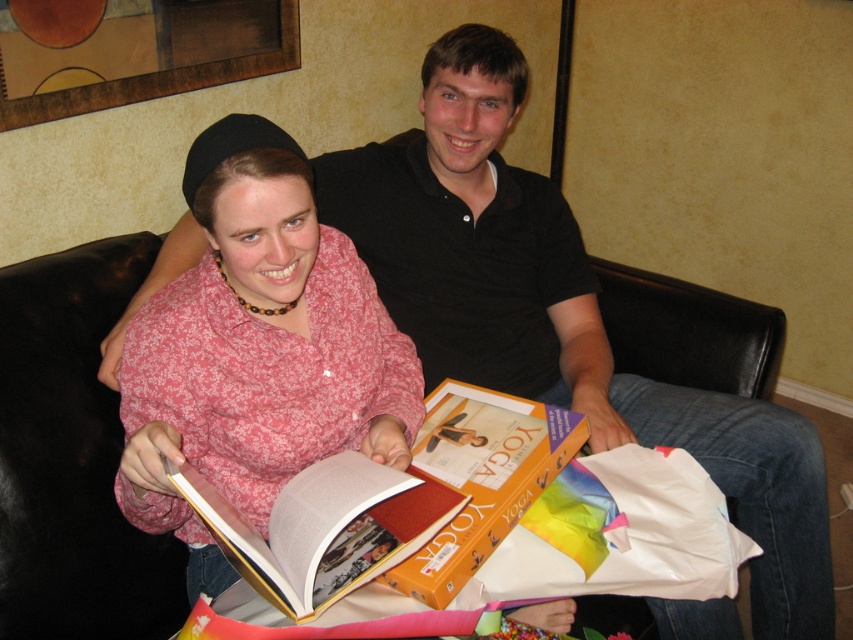
Is hardcover book at center smaller than orange matte/yellowish book at center?

Yes.

Is hardcover book at center positioned at the back of orange matte/yellowish book at center?

No, hardcover book at center is closer to the viewer.

Which is in front, point (231, 554) or point (450, 384)?

Point (231, 554) is more forward.

I want to click on hardcover book at center, so click(x=323, y=528).

Between pink floral shirt at center and hardcover book at center, which one is positioned higher?

pink floral shirt at center is higher up.

Is pink floral shirt at center wider than hardcover book at center?

Yes.

Where is `pink floral shirt at center`? pink floral shirt at center is located at coordinates (260, 353).

Which is behind, point (256, 337) or point (497, 419)?

Point (497, 419)

Can you confirm if pink floral shirt at center is thinner than orange matte/yellowish book at center?

In fact, pink floral shirt at center might be wider than orange matte/yellowish book at center.

Is point (144, 308) more distant than point (463, 561)?

Yes, point (144, 308) is behind point (463, 561).

Where is `pink floral shirt at center`? pink floral shirt at center is located at coordinates (260, 353).